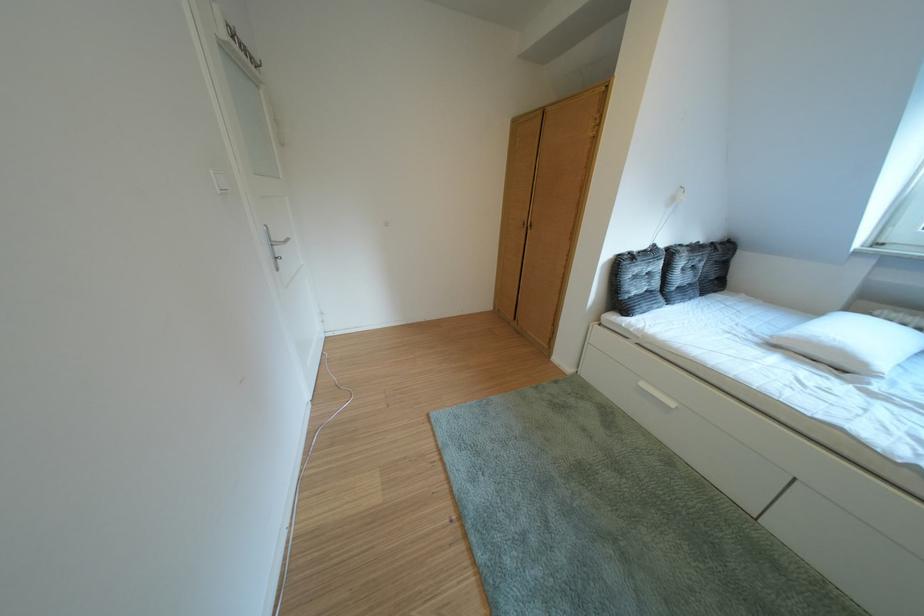
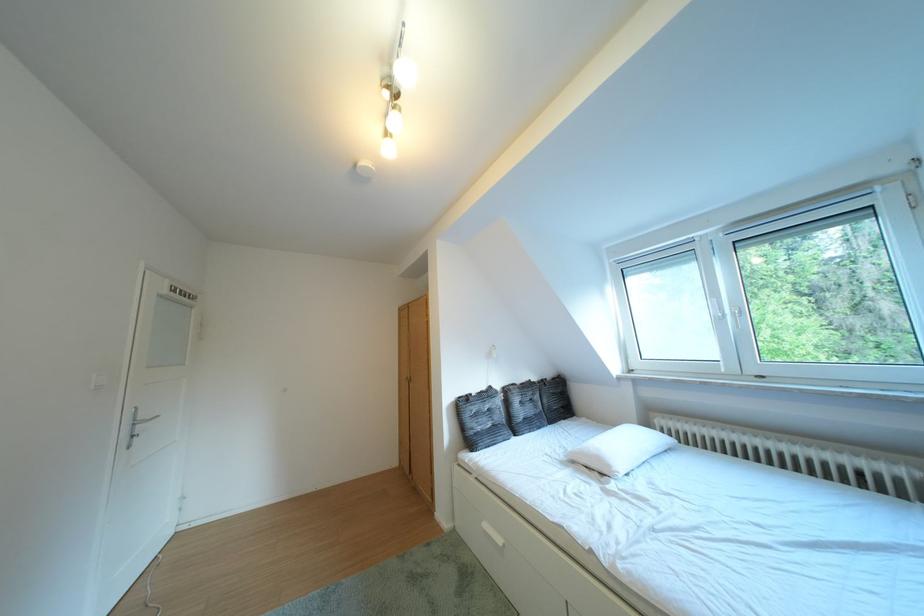
In the second image, find the point that corresponds to (669,251) in the first image.

(504, 392)